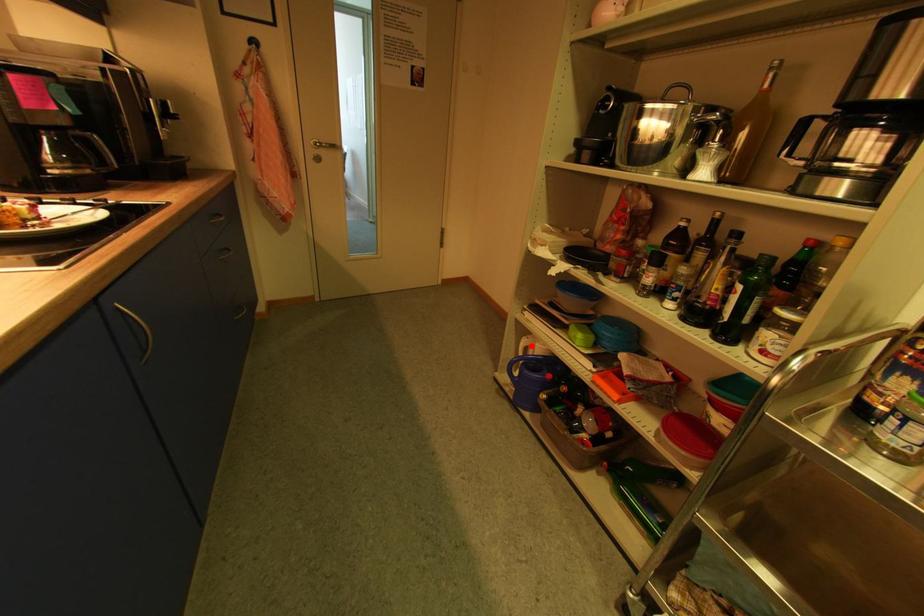
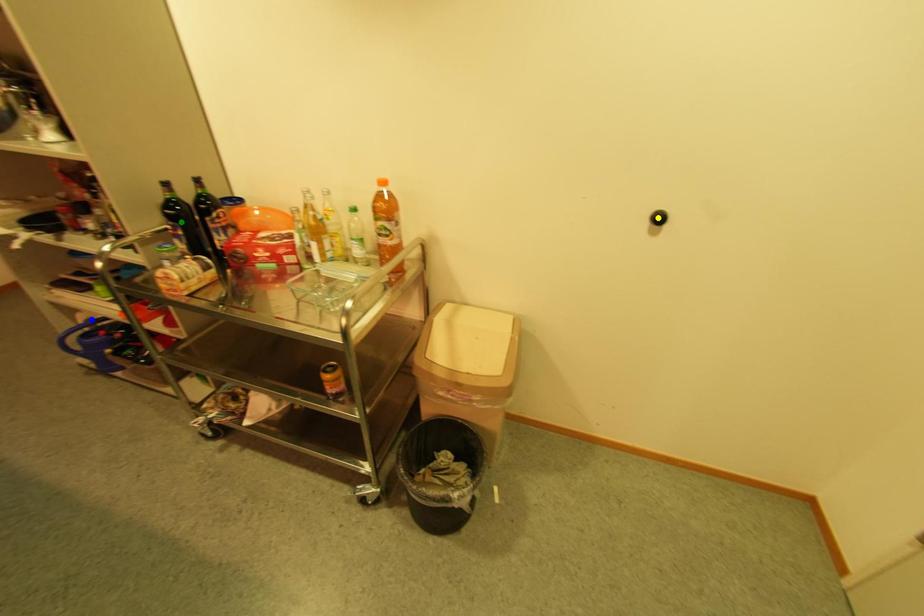
Question: I am providing you with two images of the same scene from different viewpoints. A red point is marked on the first image. You are given multiple points on the second image. Can you choose the point in image 2 that corresponds to the point in image 1?

Choices:
 (A) blue point
 (B) green point
 (C) yellow point

Answer: (A)